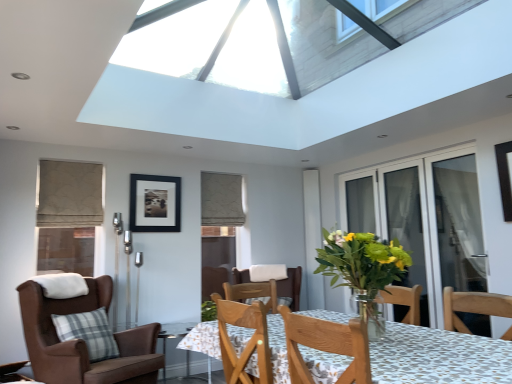
Where is `free space above transparent glass door at right, the 1th screen door positioned from the front (from a real-world perspective)`? The width and height of the screenshot is (512, 384). free space above transparent glass door at right, the 1th screen door positioned from the front (from a real-world perspective) is located at coordinates (445, 148).